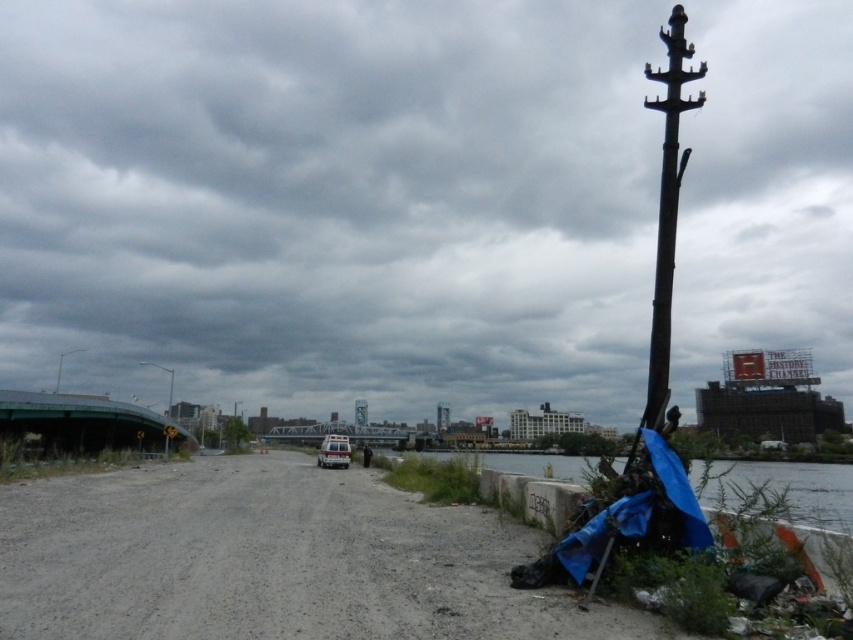
Is metallic gray pole at left further to the viewer compared to metallic gray streetlight at left?

Yes, metallic gray pole at left is behind metallic gray streetlight at left.

How far apart are metallic gray pole at left and metallic gray streetlight at left?

116.14 feet

Who is more forward, (56, 380) or (169, 412)?

Positioned in front is point (169, 412).

Locate an element on the screen. This screenshot has height=640, width=853. metallic gray pole at left is located at coordinates (62, 364).

Between metallic gray pole at left and brushed metal lamp post at center, which one appears on the left side from the viewer's perspective?

From the viewer's perspective, metallic gray pole at left appears more on the left side.

Between point (70, 353) and point (236, 403), which one is positioned in front?

Point (236, 403)

Does point (65, 349) come farther from viewer compared to point (236, 401)?

Yes, it is behind point (236, 401).

The height and width of the screenshot is (640, 853). Find the location of `metallic gray pole at left`. metallic gray pole at left is located at coordinates (62, 364).

Does dirt track at center appear under brushed metal lamp post at center?

Incorrect, dirt track at center is not positioned below brushed metal lamp post at center.

Which is in front, point (143, 561) or point (236, 413)?

Point (143, 561)

Image resolution: width=853 pixels, height=640 pixels. What do you see at coordinates (271, 561) in the screenshot? I see `dirt track at center` at bounding box center [271, 561].

Image resolution: width=853 pixels, height=640 pixels. In order to click on dirt track at center in this screenshot , I will do `click(271, 561)`.